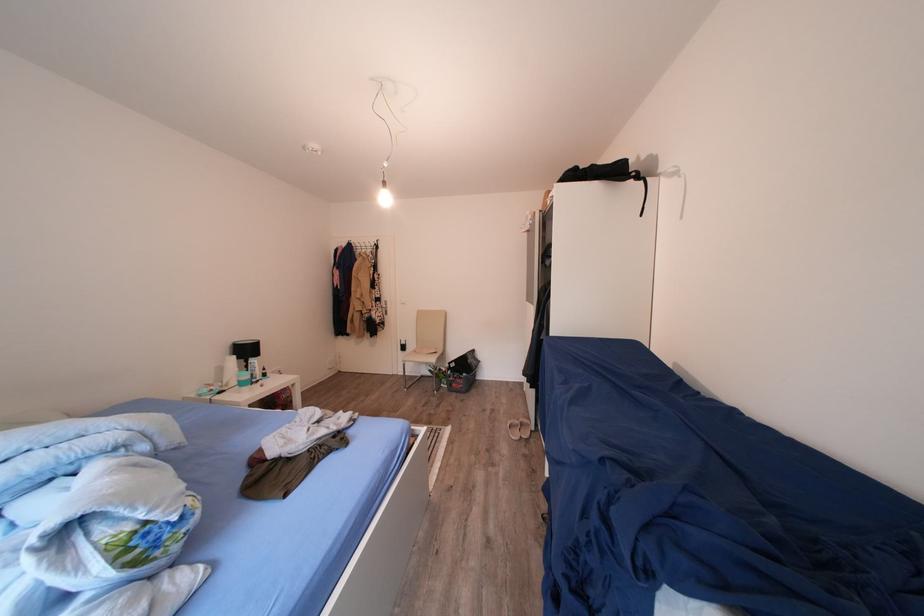
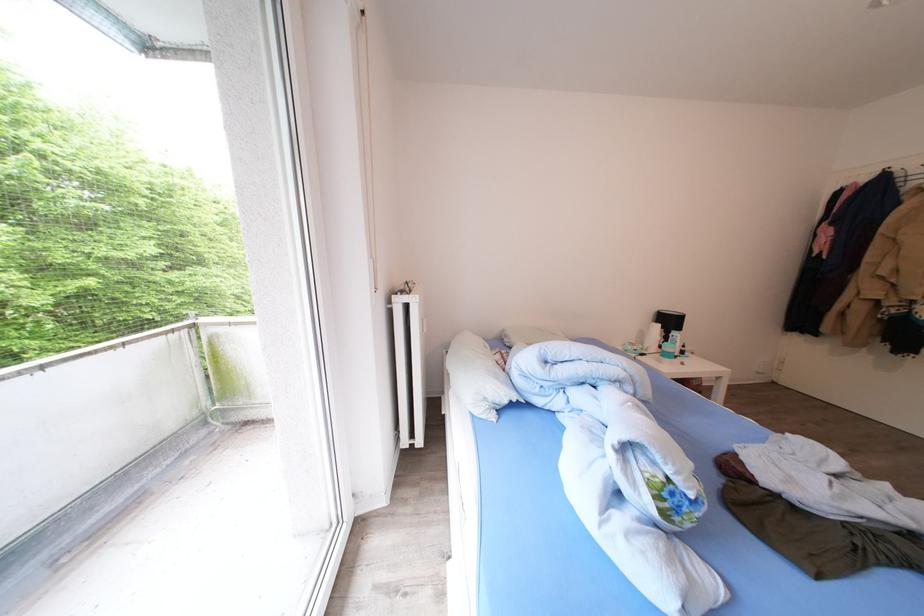
Locate, in the second image, the point that corresponds to (256,355) in the first image.

(677, 326)